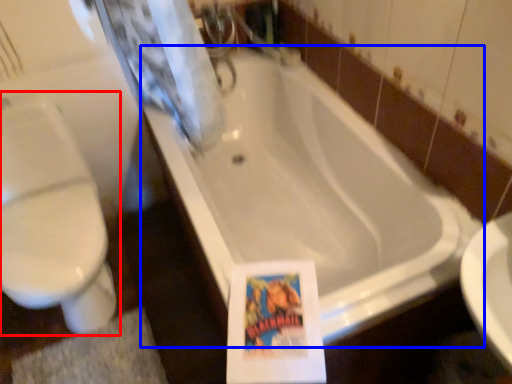
Question: Which object appears farthest to the camera in this image, toilet (highlighted by a red box) or bathtub (highlighted by a blue box)?

Choices:
 (A) toilet
 (B) bathtub

Answer: (A)